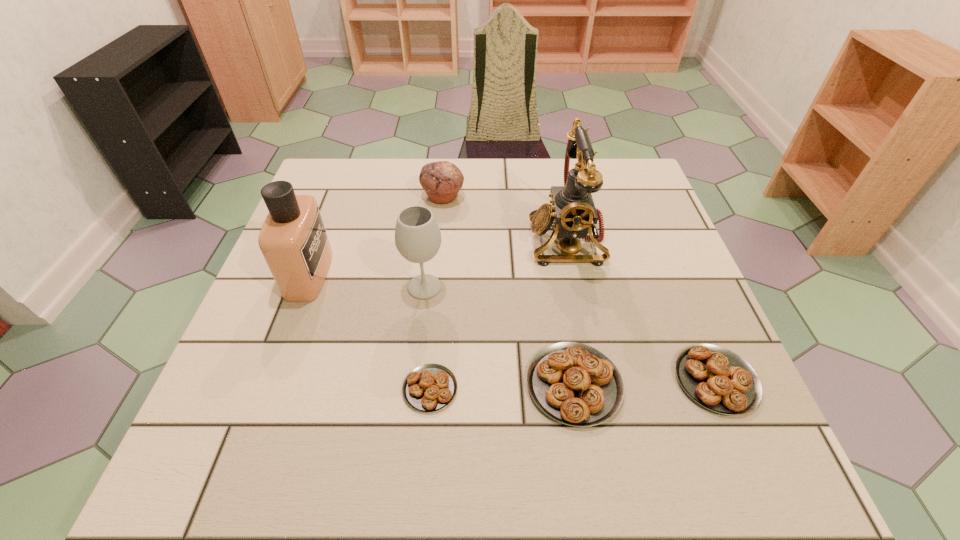
The width and height of the screenshot is (960, 540). I want to click on vacant space positioned 0.230m on the back of the shortest object, so click(440, 278).

Find the location of a particular element. This screenshot has height=540, width=960. blank area located 0.200m on the back of the second pastry from left to right is located at coordinates (556, 273).

Where is `free location located on the left of the rightmost object`? The height and width of the screenshot is (540, 960). free location located on the left of the rightmost object is located at coordinates (643, 380).

You are a GUI agent. You are given a task and a screenshot of the screen. Output one action in this format:
    pyautogui.click(x=<x>, y=<y>)
    Task: Click on the free spot located on the front of the farthest object
    
    Given the screenshot: What is the action you would take?
    pyautogui.click(x=431, y=322)

I want to click on vacant space positioned on the front of the telephone, featuring the rotary dial, so click(383, 240).

The height and width of the screenshot is (540, 960). I want to click on free region located on the front of the telephone, featuring the rotary dial, so click(x=379, y=240).

The width and height of the screenshot is (960, 540). Identify the location of vacant area situated 0.370m on the front of the telephone, featuring the rotary dial. (379, 240).

Identify the location of blank space located on the front label of the perfume. (464, 274).

Locate an element on the screen. free space located on the back of the wineglass is located at coordinates (436, 193).

Locate an element on the screen. Image resolution: width=960 pixels, height=540 pixels. object situated at the far edge is located at coordinates [442, 180].